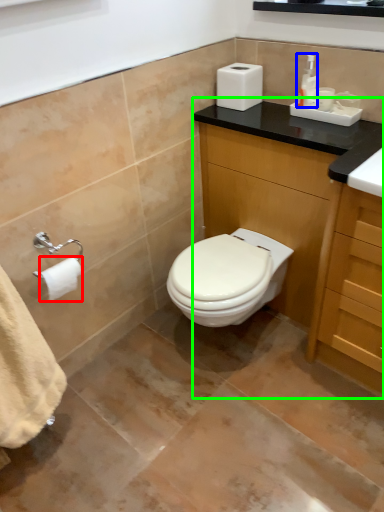
Question: Which object is the farthest from toilet paper (highlighted by a red box)? Choose among these: toiletry (highlighted by a blue box) or bathroom cabinet (highlighted by a green box).

Choices:
 (A) toiletry
 (B) bathroom cabinet

Answer: (A)